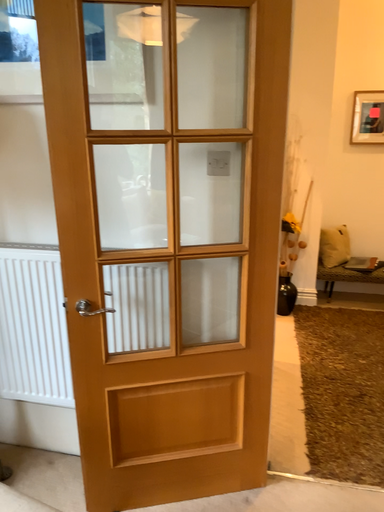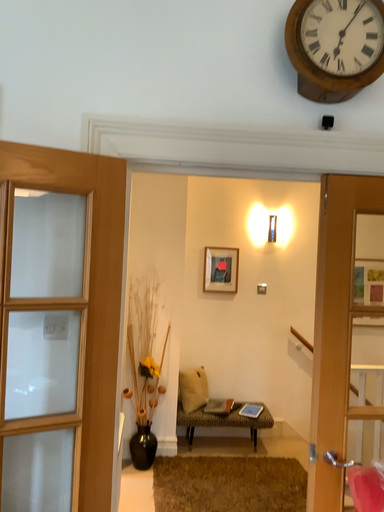
Question: How did the camera likely rotate when shooting the video?

Choices:
 (A) rotated upward
 (B) rotated downward

Answer: (A)